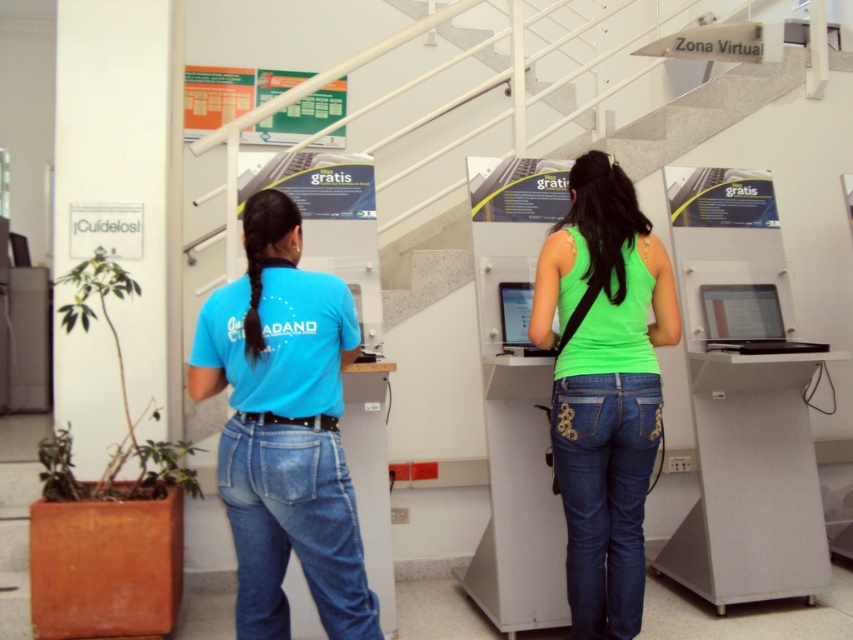
Is point (595, 273) positioned behind point (728, 323)?

No.

I want to click on neon green tank top at center, so click(604, 387).

The image size is (853, 640). I want to click on neon green tank top at center, so click(x=604, y=387).

Does blue denim jeans at center appear on the left side of dark blue denim jeans at center?

Yes, blue denim jeans at center is to the left of dark blue denim jeans at center.

Does blue denim jeans at center appear on the right side of dark blue denim jeans at center?

No, blue denim jeans at center is not to the right of dark blue denim jeans at center.

Which is in front, point (228, 460) or point (601, 548)?

Point (228, 460) is more forward.

Locate an element on the screen. This screenshot has height=640, width=853. blue denim jeans at center is located at coordinates (293, 529).

In the scene shown: Does neon green tank top at center have a greater height compared to matte black monitor at center?

Yes.

From the picture: Is neon green tank top at center to the right of matte black monitor at center from the viewer's perspective?

Correct, you'll find neon green tank top at center to the right of matte black monitor at center.

Who is more distant from viewer, (x=641, y=435) or (x=520, y=333)?

Point (x=520, y=333)

Find the location of a particular element. Image resolution: width=853 pixels, height=640 pixels. neon green tank top at center is located at coordinates pos(604,387).